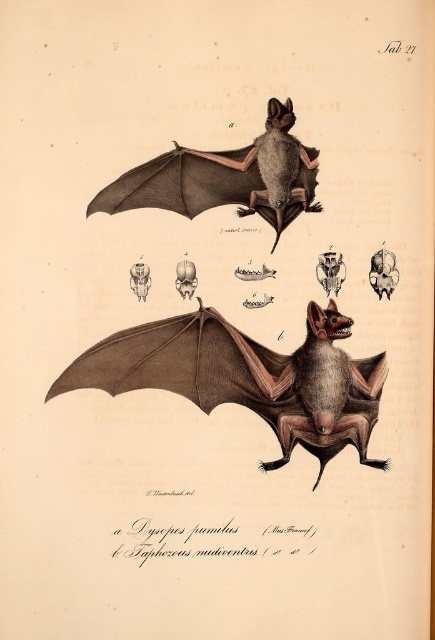
Is brown textured bat at center wider than brown matte bat at upper center?

Indeed, brown textured bat at center has a greater width compared to brown matte bat at upper center.

Is brown textured bat at center to the right of brown matte bat at upper center from the viewer's perspective?

Indeed, brown textured bat at center is positioned on the right side of brown matte bat at upper center.

Locate an element on the screen. brown textured bat at center is located at coordinates (247, 378).

This screenshot has height=640, width=435. Identify the location of brown textured bat at center. (247, 378).